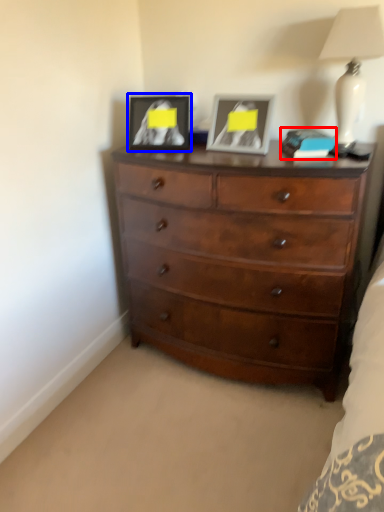
Question: Which object is closer to the camera taking this photo, book (highlighted by a red box) or picture frame (highlighted by a blue box)?

Choices:
 (A) book
 (B) picture frame

Answer: (A)